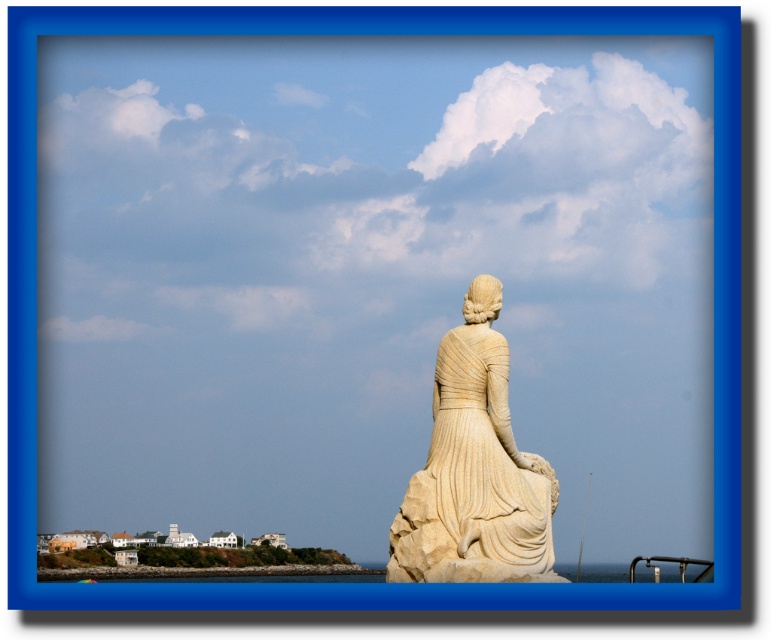
You are a photographer planning to capture the white marble statue at center and the clear blue water at lower center in a single frame. Based on their sizes in the scene, which object would appear smaller in the photo?

The white marble statue at center has a lesser height compared to the clear blue water at lower center, so it would appear smaller in the photo.

You are a tourist standing at the edge of the cliff overlooking the sea. You see the white marble statue at center and the clear blue water at lower center. Which object is nearer to you?

The white marble statue at center is closer to the viewer than the clear blue water at lower center, so the statue is nearer to you.

You are a tourist standing on the coast looking at the white marble statue at center and the clear blue water at lower center. Which object is closer to your viewpoint?

The white marble statue at center is closer to your viewpoint because it is positioned above the clear blue water at lower center, indicating it is higher in elevation.